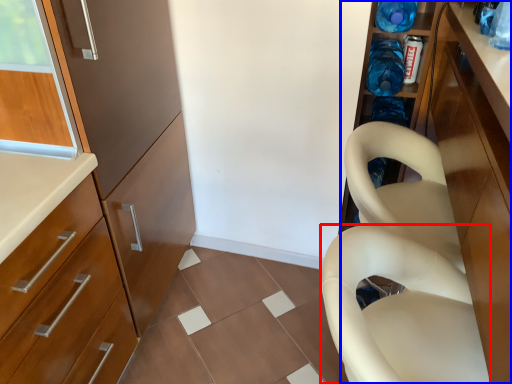
Question: Which object is further to the camera taking this photo, feeding chair (highlighted by a red box) or cabinetry (highlighted by a blue box)?

Choices:
 (A) feeding chair
 (B) cabinetry

Answer: (A)